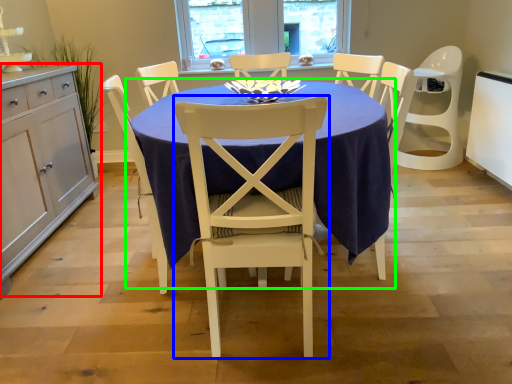
Question: Which object is positioned farthest from cabinetry (highlighted by a red box)? Select from chair (highlighted by a blue box) and kitchen & dining room table (highlighted by a green box).

Choices:
 (A) chair
 (B) kitchen & dining room table

Answer: (A)